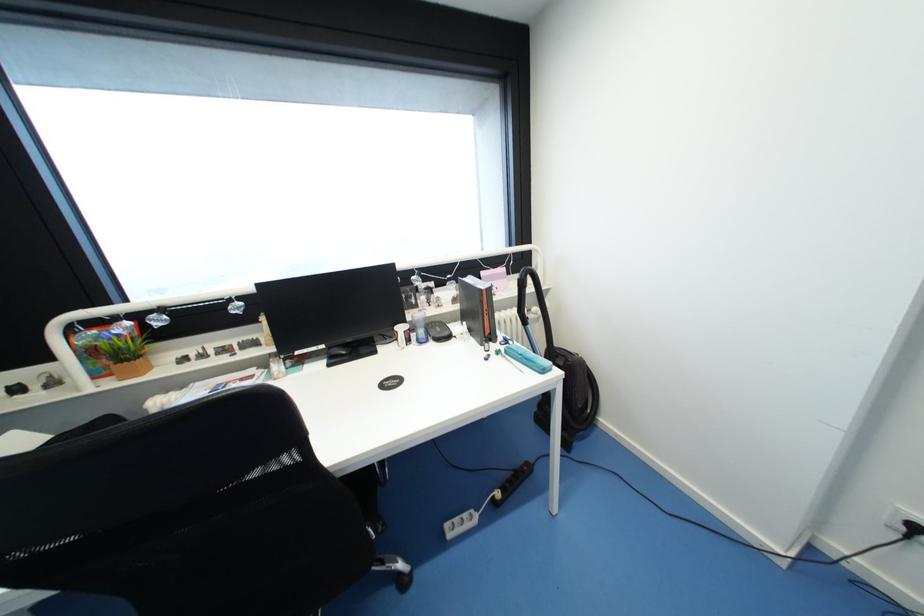
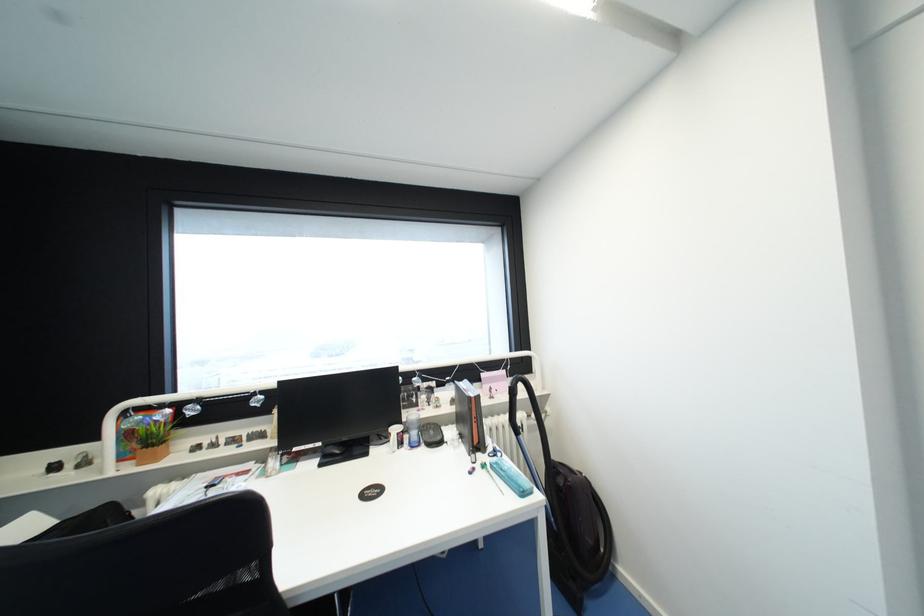
Where in the second image is the point corresponding to the point at 524,286 from the first image?

(515, 394)